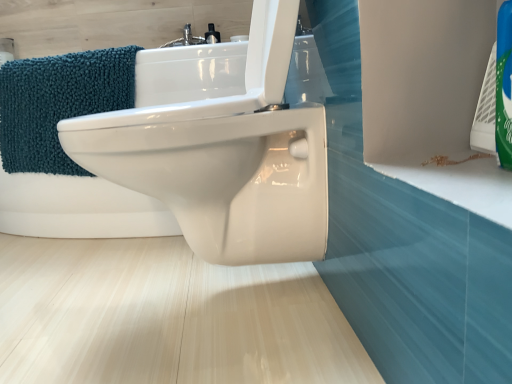
Question: Can you confirm if white glossy bidet at center is taller than teal chenille bath towel at left?

Choices:
 (A) no
 (B) yes

Answer: (B)

Question: From a real-world perspective, is white glossy bidet at center below teal chenille bath towel at left?

Choices:
 (A) no
 (B) yes

Answer: (B)

Question: Is white glossy bidet at center bigger than teal chenille bath towel at left?

Choices:
 (A) yes
 (B) no

Answer: (A)

Question: Can we say white glossy bidet at center lies outside teal chenille bath towel at left?

Choices:
 (A) yes
 (B) no

Answer: (A)

Question: Is white glossy bidet at center thinner than teal chenille bath towel at left?

Choices:
 (A) yes
 (B) no

Answer: (B)

Question: Is white glossy bidet at center facing away from teal chenille bath towel at left?

Choices:
 (A) yes
 (B) no

Answer: (A)

Question: Is teal chenille bath towel at left far from white glossy bidet at center?

Choices:
 (A) no
 (B) yes

Answer: (A)

Question: From the image's perspective, is teal chenille bath towel at left located beneath white glossy bidet at center?

Choices:
 (A) yes
 (B) no

Answer: (A)

Question: Is teal chenille bath towel at left oriented towards white glossy bidet at center?

Choices:
 (A) no
 (B) yes

Answer: (B)

Question: Is teal chenille bath towel at left outside of white glossy bidet at center?

Choices:
 (A) yes
 (B) no

Answer: (B)

Question: Is teal chenille bath towel at left turned away from white glossy bidet at center?

Choices:
 (A) no
 (B) yes

Answer: (B)

Question: From a real-world perspective, is teal chenille bath towel at left beneath white glossy bidet at center?

Choices:
 (A) yes
 (B) no

Answer: (B)

Question: From a real-world perspective, is white glossy bidet at center above or below teal chenille bath towel at left?

Choices:
 (A) above
 (B) below

Answer: (B)